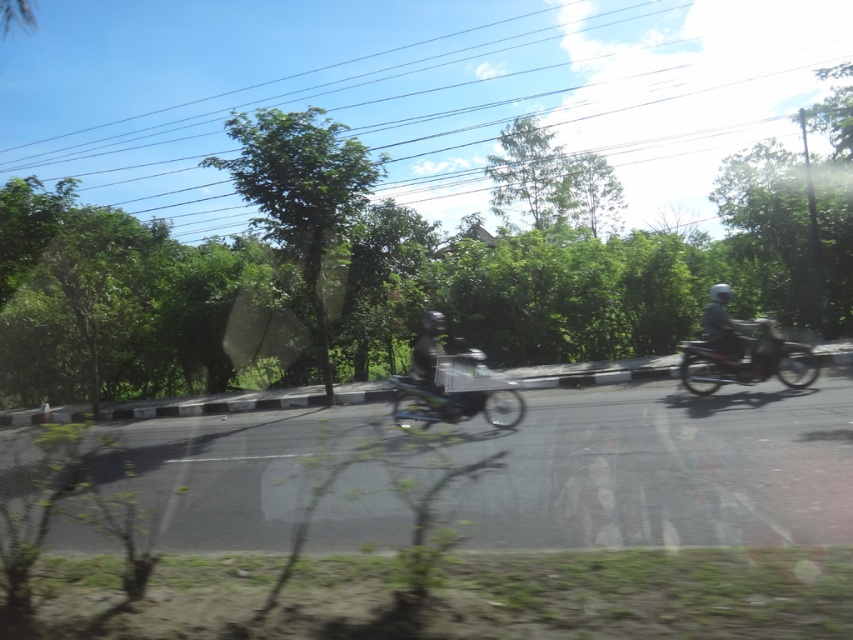
You are a pedestrian standing on the road and see the metallic silver motorcycle at right and the metallic silver bicycle at center. Which one is closer to you?

The metallic silver motorcycle at right is positioned over the metallic silver bicycle at center, meaning it is closer to you.

You are a delivery rider who needs to choose between the metallic silver motorcycle at right and the metallic silver bicycle at center for a long trip. Considering their sizes, which vehicle would be more suitable for carrying heavy packages?

The metallic silver bicycle at center is larger in size compared to the metallic silver motorcycle at right, making it potentially better suited for carrying heavy packages due to its size advantage.